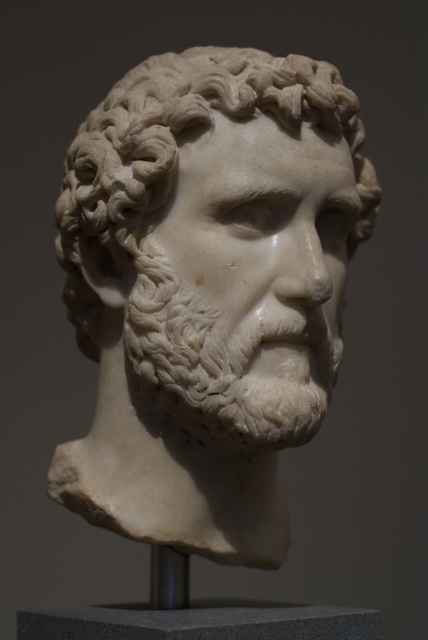
In the scene shown: You are an art conservator examining the classical marble bust and its pedestal. Based on the provided scene, which object is taller between the white marble bust at center and the gray granite pedestal at center?

The white marble bust at center is taller than the gray granite pedestal at center.

You are an art conservator examining the classical marble bust. You notice two points on the sculpture marked at coordinates point [127,275] and point [374,634]. Which point is closer to the viewer?

Point [127,275] is in front of point [374,634], so it is closer to the viewer.